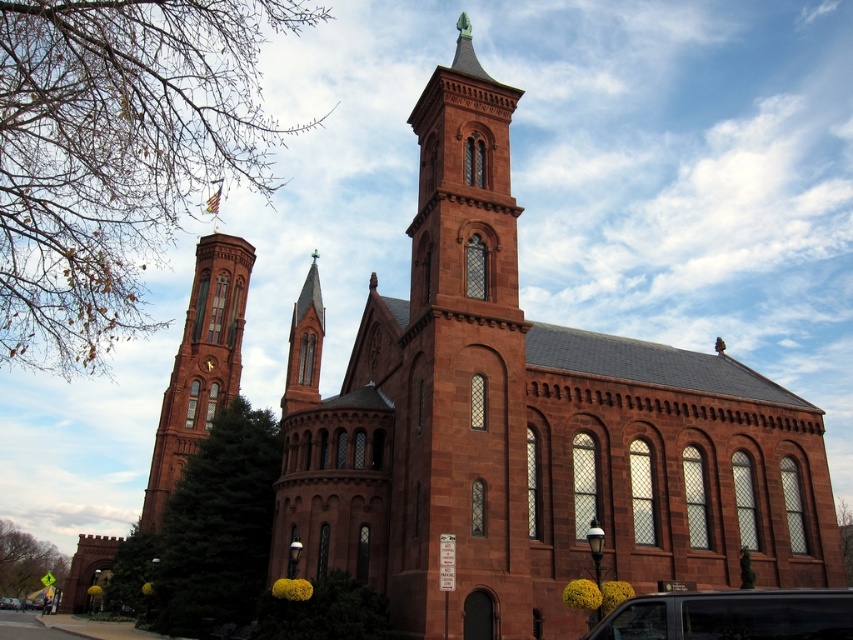
Question: Based on their relative distances, which object is farther from the matte brick tower at left?

Choices:
 (A) black matte van at lower right
 (B) red stone tower at center

Answer: (A)

Question: In this image, where is red stone tower at center located relative to matte brick tower at left?

Choices:
 (A) right
 (B) left

Answer: (A)

Question: Does matte brick tower at left have a larger size compared to black matte van at lower right?

Choices:
 (A) yes
 (B) no

Answer: (A)

Question: Which point is farther to the camera?

Choices:
 (A) matte brick tower at left
 (B) red stone tower at center

Answer: (A)

Question: Is red stone tower at center wider than black matte van at lower right?

Choices:
 (A) no
 (B) yes

Answer: (A)

Question: Among these points, which one is nearest to the camera?

Choices:
 (A) (630, 600)
 (B) (195, 387)

Answer: (A)